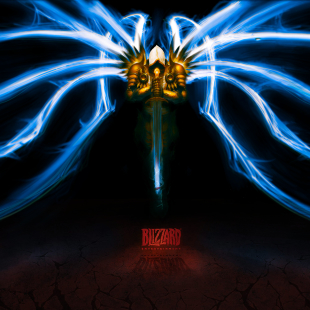
Where is `hood`? hood is located at coordinates (157, 53).